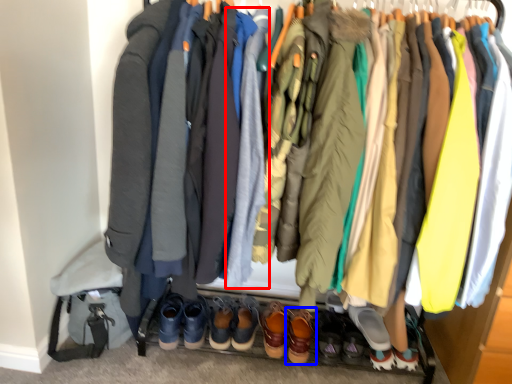
Question: Which point is further to the camera, robe (highlighted by a red box) or footwear (highlighted by a blue box)?

Choices:
 (A) robe
 (B) footwear

Answer: (B)